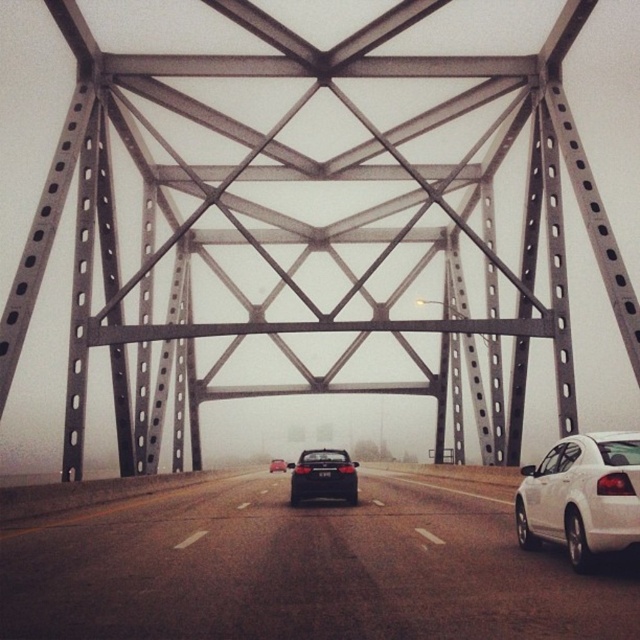
You are standing on the bridge and see a white car on the right side of the road and a black car ahead. Where is the shiny black sedan at center located relative to the point marked at coordinates (276,465)?

The point marked at coordinates (276,465) corresponds to the shiny black sedan at center, so they are in the same location.

Consider the image. You are driving a car that requires a 25 meter distance to safely stop. You see a matte black sedan at center ahead. Can you safely stop before hitting it if you need to?

The distance between your car and the matte black sedan at center is 20.75 meters, which is less than the required 25 meters to safely stop. Therefore, you cannot safely stop before hitting it.

You are driving a car and see the smooth asphalt highway at center and the matte black sedan at center. Which object is positioned to the left of the other?

The smooth asphalt highway at center is to the left of the matte black sedan at center.